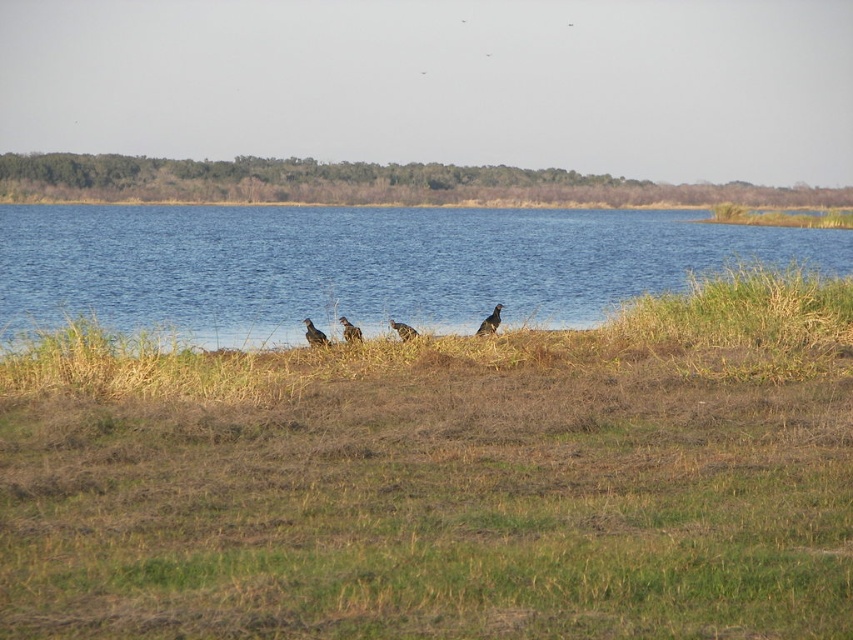
You are standing at the point marked by the coordinates point (363, 266). Based on the scene described, what would you see directly in front of you?

The point (363, 266) indicates blue water at center, so you would see blue water at center directly in front of you.

You are a birdwatcher observing the scene. You notice brown dry grass at center and dark gray feathers at center. Which object is located higher in the image?

The dark gray feathers at center are higher than the brown dry grass at center.

You are standing at the edge of the water in the image. Looking towards the center, can you see the brown dry grass at center?

Yes, the brown dry grass at center is located at point (444, 477), which is in the center of the image, so you can see it when looking towards the center from the edge of the water.